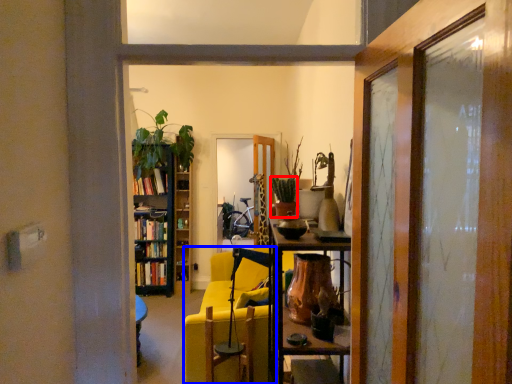
Question: Which of the following is the closest to the observer, houseplant (highlighted by a red box) or chair (highlighted by a blue box)?

Choices:
 (A) houseplant
 (B) chair

Answer: (A)